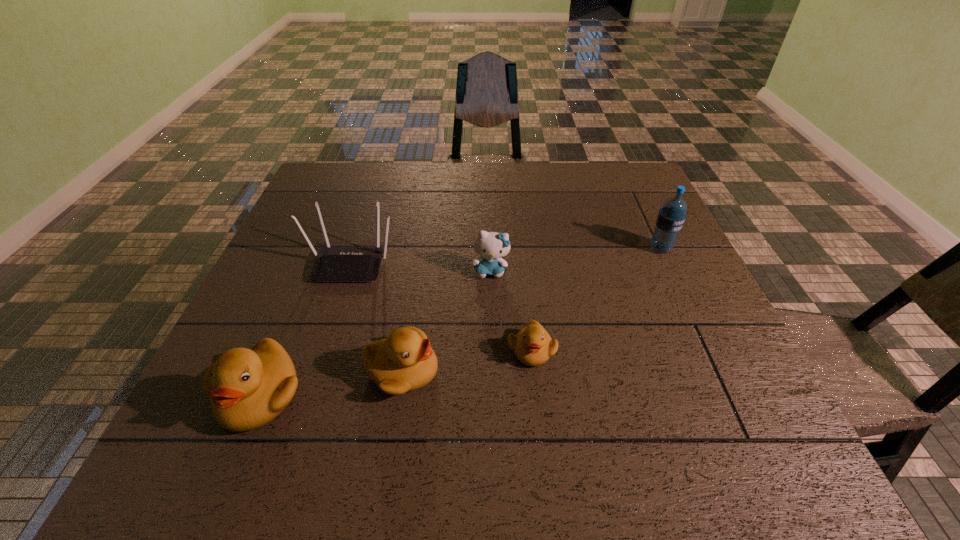
The image size is (960, 540). What are the coordinates of `the closest object to the water bottle` in the screenshot? It's located at (490, 246).

The image size is (960, 540). What are the coordinates of `object that is the fifth closest to the tallest object` in the screenshot? It's located at (248, 388).

This screenshot has width=960, height=540. Find the location of `duckling that stands as the closest to the router`. duckling that stands as the closest to the router is located at coordinates (405, 361).

This screenshot has height=540, width=960. I want to click on duckling that is the nearest to the second duckling from left to right, so click(248, 388).

The width and height of the screenshot is (960, 540). I want to click on vacant space that satisfies the following two spatial constraints: 1. on the face of the kitten; 2. on the front-facing side of the second tallest duckling, so click(493, 371).